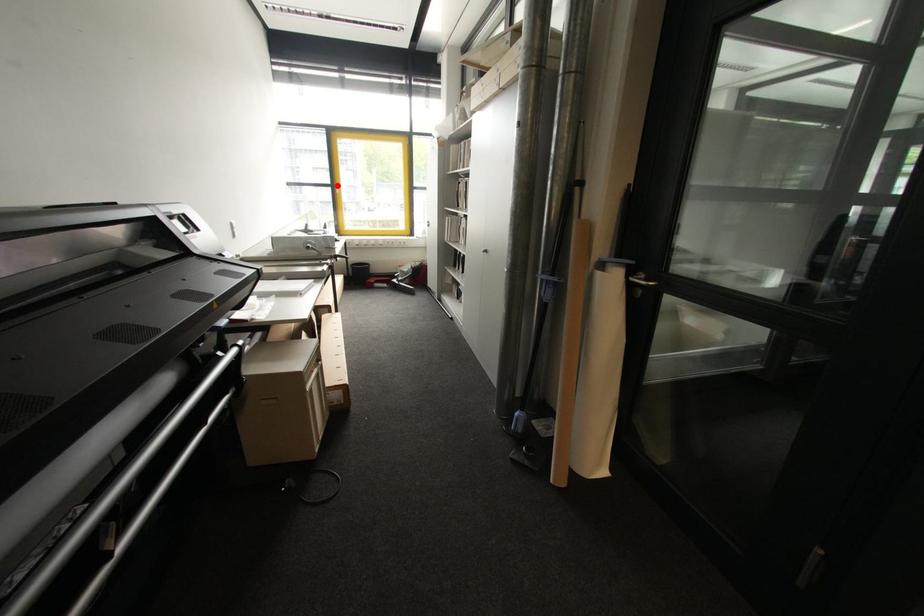
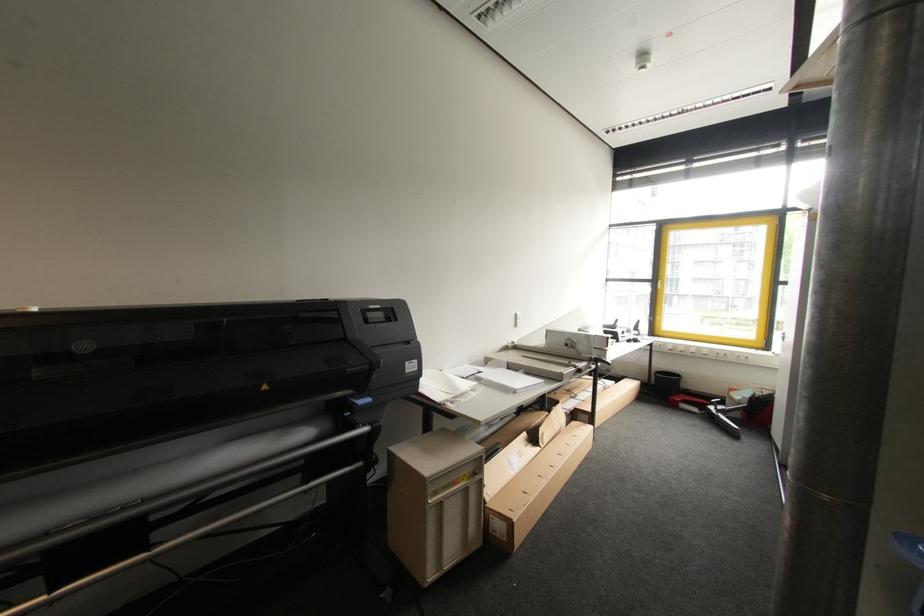
Question: I am providing you with two images of the same scene from different viewpoints. A red point is shown in image1. For the corresponding object point in image2, is it positioned nearer or farther from the camera?

Choices:
 (A) Nearer
 (B) Farther

Answer: (B)